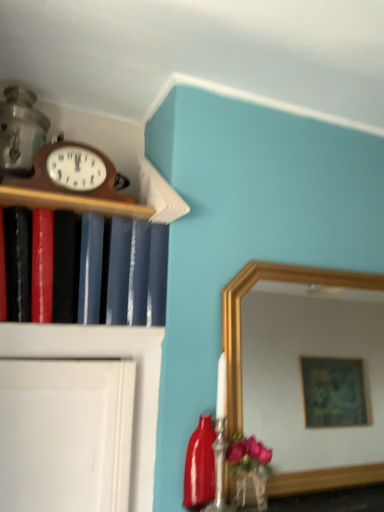
Question: From the image's perspective, is glossy ceramic bottle at lower right positioned above or below matte black book at left?

Choices:
 (A) below
 (B) above

Answer: (A)

Question: Would you say glossy ceramic bottle at lower right is inside or outside matte black book at left?

Choices:
 (A) outside
 (B) inside

Answer: (A)

Question: Which object is positioned closest to the wooden clock at upper left?

Choices:
 (A) matte black book at left
 (B) woodenmaterial/texture wall clock at upper left
 (C) glossy ceramic bottle at lower right

Answer: (B)

Question: Which of these objects is positioned farthest from the glossy ceramic bottle at lower right?

Choices:
 (A) woodenmaterial/texture wall clock at upper left
 (B) matte black book at left
 (C) wooden clock at upper left

Answer: (A)